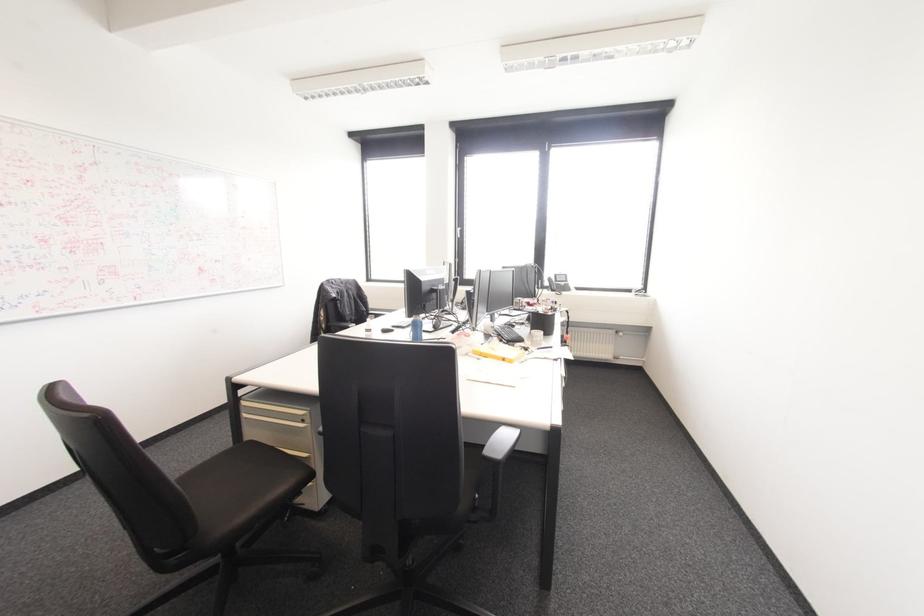
Where would you lift the telephone handset? Please return your answer as a coordinate pair (x, y).

(499, 334)